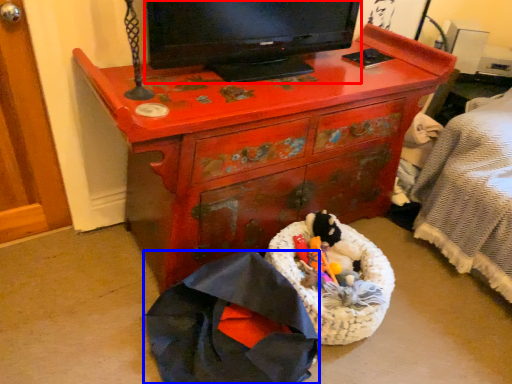
Question: Which object appears farthest to the camera in this image, television (highlighted by a red box) or clothing (highlighted by a blue box)?

Choices:
 (A) television
 (B) clothing

Answer: (A)